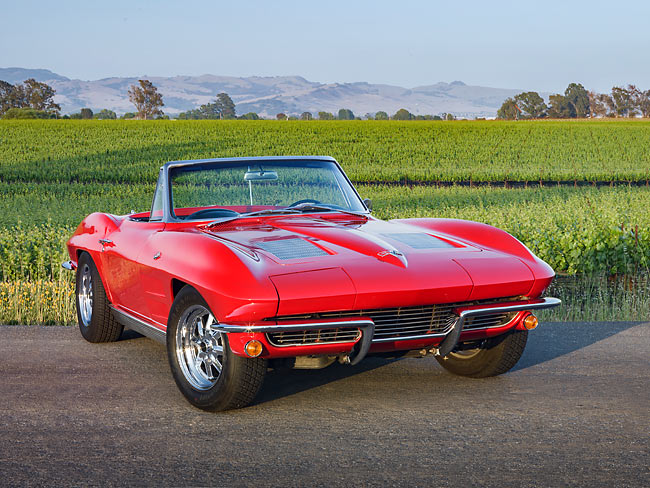
I want to click on door handle, so click(x=103, y=243).